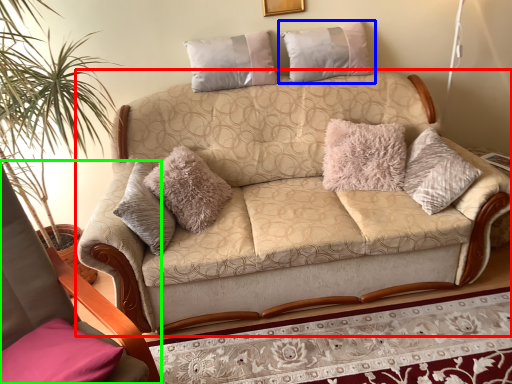
Question: Estimate the real-world distances between objects in this image. Which object is closer to studio couch (highlighted by a red box), pillow (highlighted by a blue box) or rocking chair (highlighted by a green box)?

Choices:
 (A) pillow
 (B) rocking chair

Answer: (A)